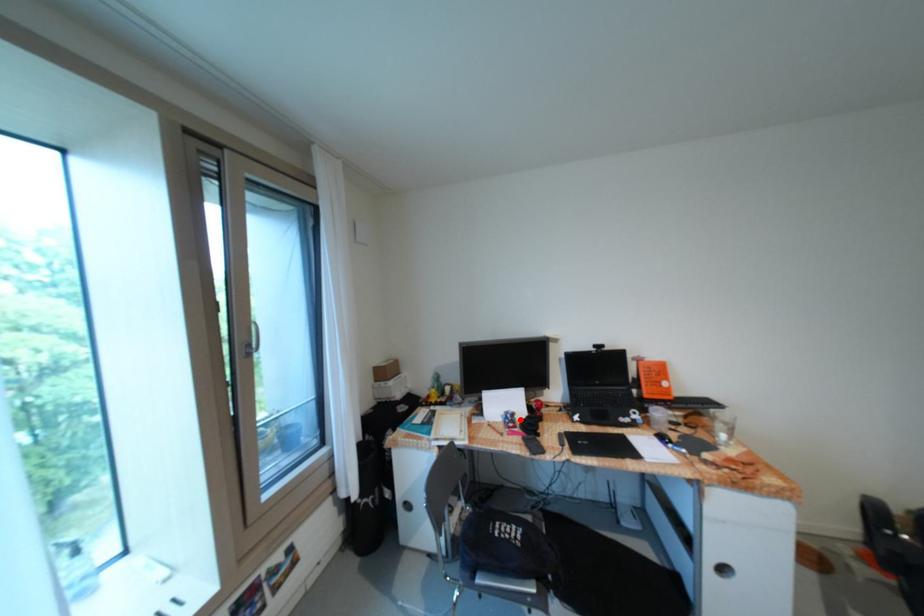
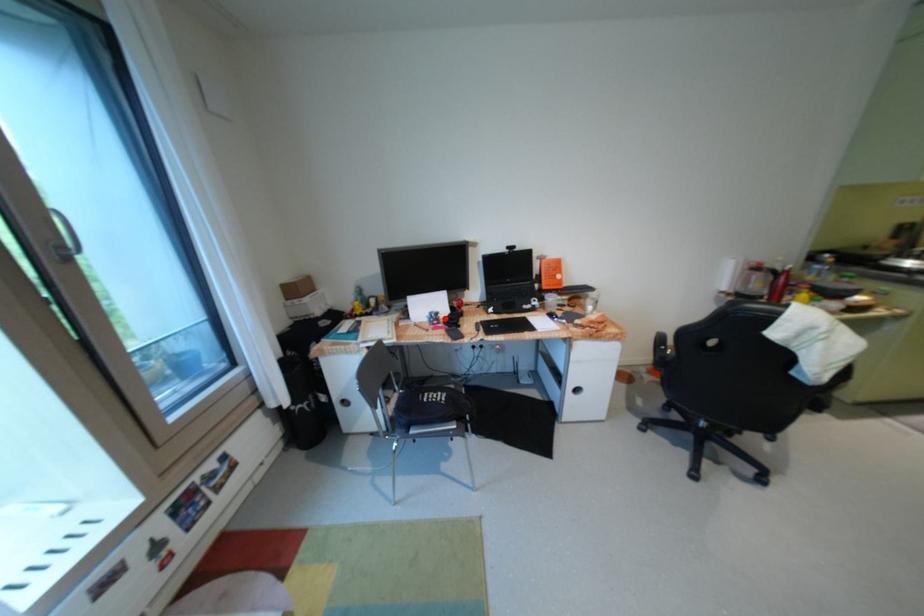
I am providing you with two images of the same scene from different viewpoints. A red point is marked on the first image and another point is marked on the second image. Is the marked point in image1 the same physical position as the marked point in image2?

Yes